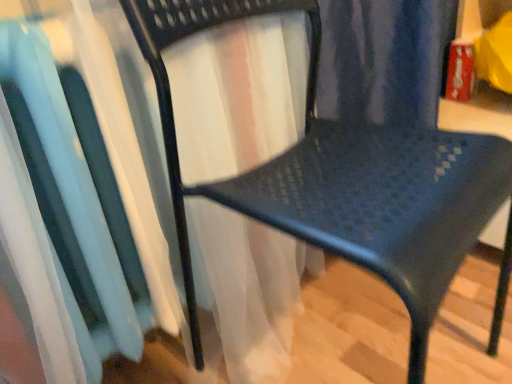
What do you see at coordinates (62, 215) in the screenshot? I see `white sheer curtain at left` at bounding box center [62, 215].

I want to click on white sheer curtain at left, so click(x=62, y=215).

Where is `white sheer curtain at left`? white sheer curtain at left is located at coordinates (62, 215).